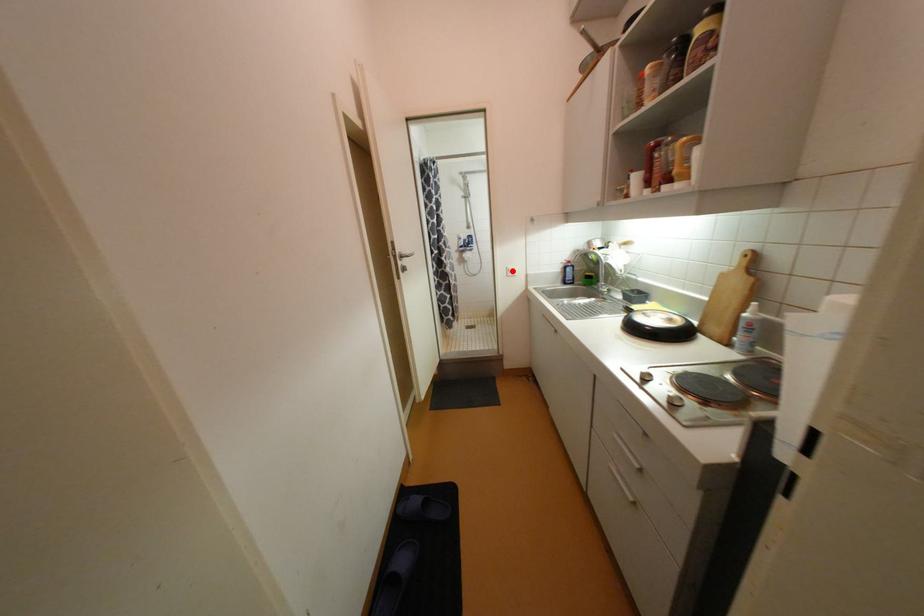
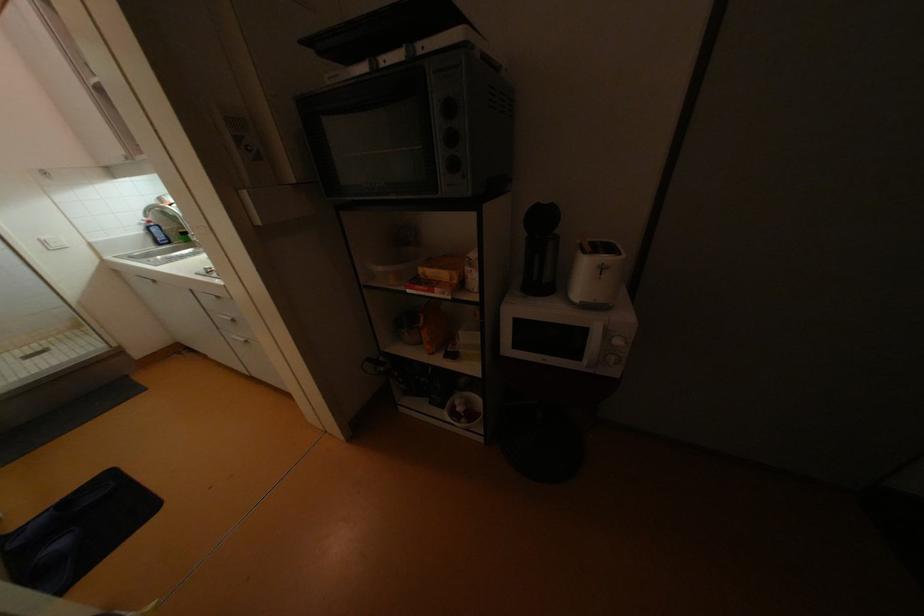
Question: I am providing you with two images of the same scene from different viewpoints. A red point is shown in image1. For the corresponding object point in image2, is it positioned nearer or farther from the camera?

Choices:
 (A) Nearer
 (B) Farther

Answer: (B)